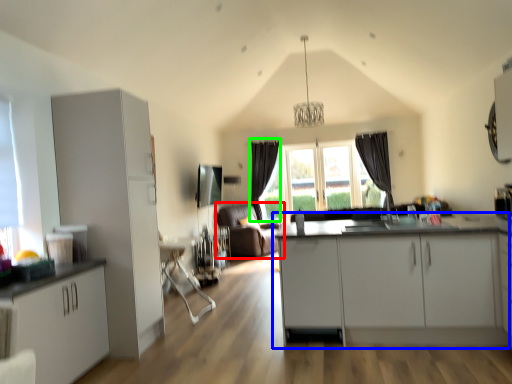
Question: Which is nearer to the couch (highlighted by a red box)? cabinetry (highlighted by a blue box) or curtain (highlighted by a green box).

Choices:
 (A) cabinetry
 (B) curtain

Answer: (B)